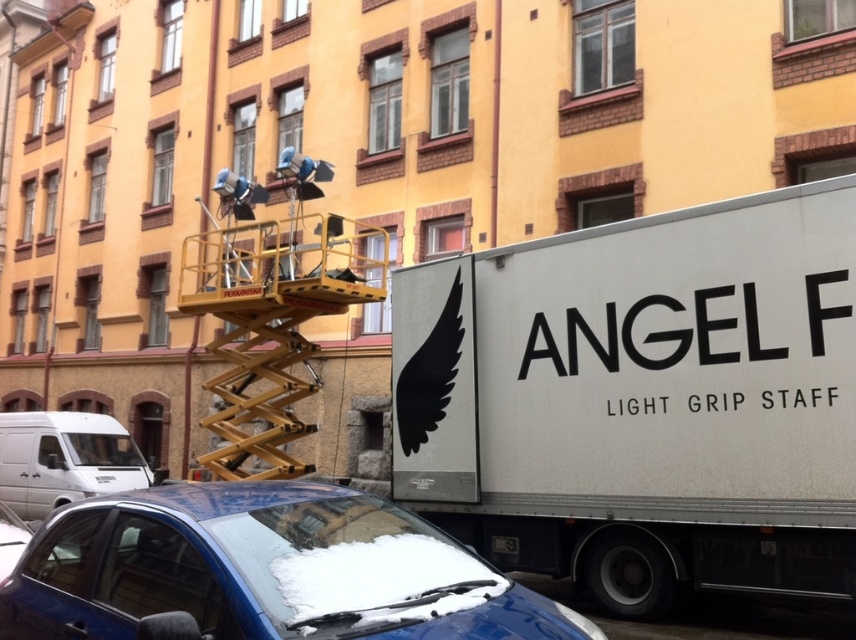
Question: Which object is farther from the camera taking this photo?

Choices:
 (A) white matte truck at center
 (B) white matte van at lower left

Answer: (B)

Question: Which object appears closest to the camera in this image?

Choices:
 (A) white matte truck at center
 (B) white matte van at lower left

Answer: (A)

Question: Can you confirm if white matte truck at center is bigger than blue matte car at lower center?

Choices:
 (A) yes
 (B) no

Answer: (A)

Question: Is blue matte car at lower center positioned before white matte van at lower left?

Choices:
 (A) yes
 (B) no

Answer: (A)

Question: Which object is positioned closest to the white matte truck at center?

Choices:
 (A) blue matte car at lower center
 (B) black plastic license plate at lower center

Answer: (B)

Question: In this image, where is white matte van at lower left located relative to black plastic license plate at lower center?

Choices:
 (A) right
 (B) left

Answer: (B)